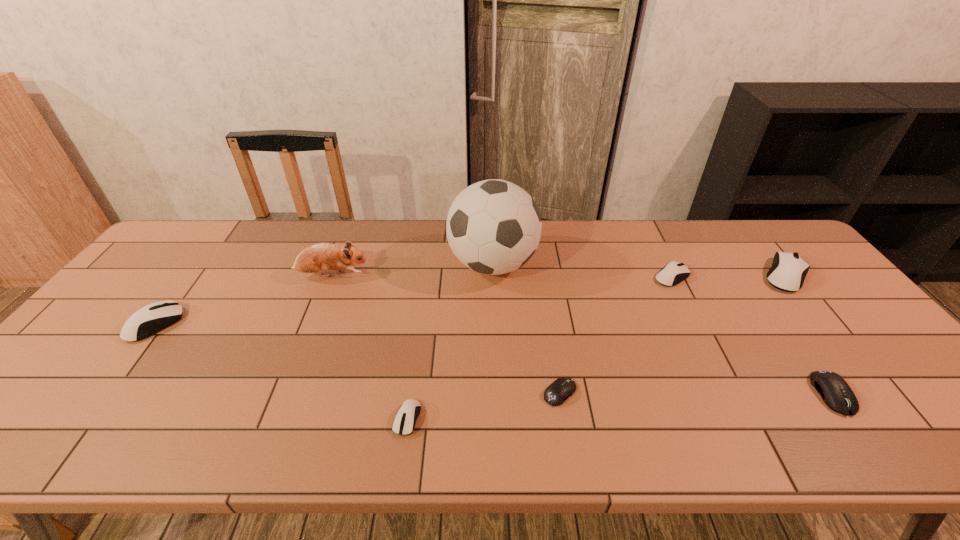
I want to click on the fourth closest white mouse to the black soccer ball, so click(149, 320).

Point out which white mouse is positioned as the third nearest to the third computer equipment from left to right. Please provide its 2D coordinates. Your answer should be formatted as a tuple, i.e. [(x, y)], where the tuple contains the x and y coordinates of a point satisfying the conditions above.

[(788, 271)]

Locate an element on the screen. The height and width of the screenshot is (540, 960). free location that satisfies the following two spatial constraints: 1. at the face of the brown hamster; 2. on the right side of the right black computer equipment is located at coordinates (287, 394).

What are the coordinates of `vacant point that satisfies the following two spatial constraints: 1. at the face of the second tallest object; 2. on the back side of the smaller black computer equipment` in the screenshot? It's located at (288, 393).

Locate an element on the screen. The width and height of the screenshot is (960, 540). vacant space that satisfies the following two spatial constraints: 1. on the back side of the smallest white mouse; 2. at the face of the brown hamster is located at coordinates (427, 275).